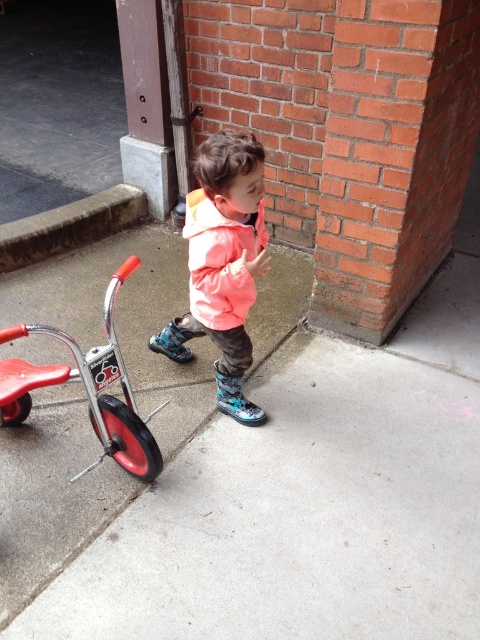
You are a delivery robot that needs to navigate around the child and their metallic red tricycle at left. Since the matte orange jacket at center is on the right side of the tricycle, which direction should you move to avoid them?

Since the matte orange jacket at center is on the right side of the metallic red tricycle at left, you should move to the left to avoid both the child and the tricycle.

The child is wearing a matte orange jacket at center and has a metallic red tricycle at left. Which object is covering the other one?

The matte orange jacket at center is positioned over metallic red tricycle at left, so the jacket is covering the tricycle.